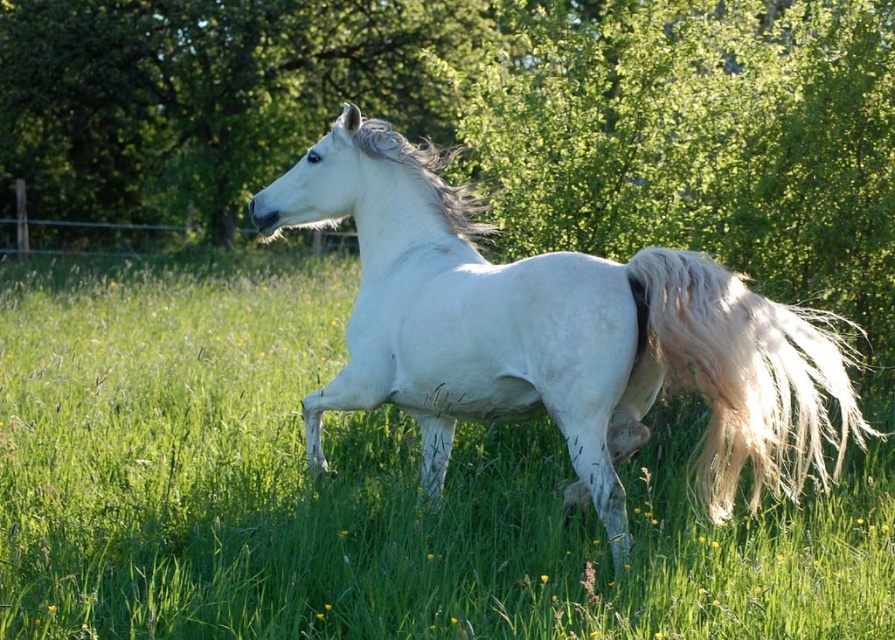
You are a photographer positioned in the field and want to capture both the green grass at center and the white silky tail at right in your photo. Which object should you focus on first to ensure both are in sharp focus?

You should focus on the green grass at center first because it is closer to you than the white silky tail at right, ensuring both will be in focus when focused on the closer object.

You are a photographer trying to capture the white silky mane at center and the green grass at center in a single shot. Based on their positions, which one will appear closer to the camera?

The white silky mane at center appears closer to the camera because it is above the green grass at center, which is positioned below it.